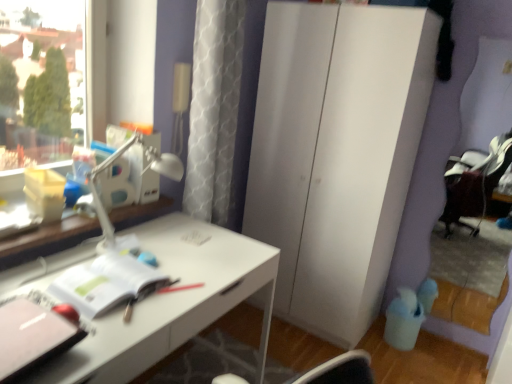
The height and width of the screenshot is (384, 512). I want to click on vacant space to the right of white plastic table lamp at upper left, so click(x=200, y=260).